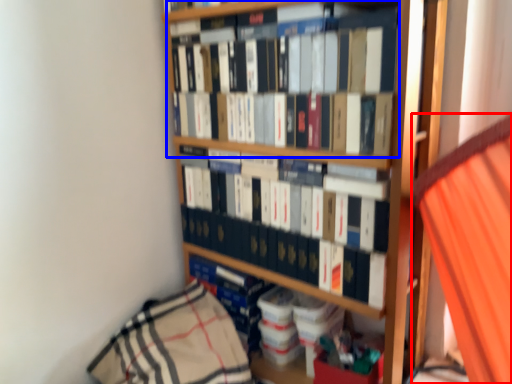
Question: Which object appears farthest to the camera in this image, curtain (highlighted by a red box) or book (highlighted by a blue box)?

Choices:
 (A) curtain
 (B) book

Answer: (B)